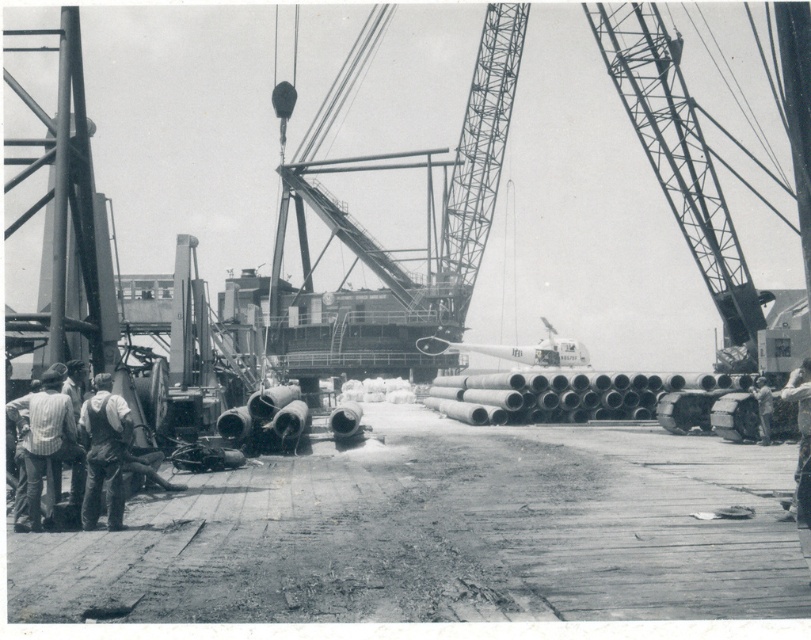
Question: Which of the following is the closest to the observer?

Choices:
 (A) click(x=767, y=410)
 (B) click(x=108, y=404)

Answer: (B)

Question: Is smooth concrete pipes at lower left to the left of metallic gray crane at right from the viewer's perspective?

Choices:
 (A) yes
 (B) no

Answer: (A)

Question: Which object is positioned farthest from the smooth concrete pipes at lower left?

Choices:
 (A) metallic gray crane at right
 (B) striped shirt at left
 (C) denim overalls at lower left

Answer: (A)

Question: Which point is closer to the camera?

Choices:
 (A) (679, 45)
 (B) (97, 470)

Answer: (B)

Question: Can you confirm if metallic gray crane at center is positioned to the left of striped shirt at left?

Choices:
 (A) no
 (B) yes

Answer: (A)

Question: Is metallic gray crane at center closer to camera compared to metallic gray crane at right?

Choices:
 (A) yes
 (B) no

Answer: (B)